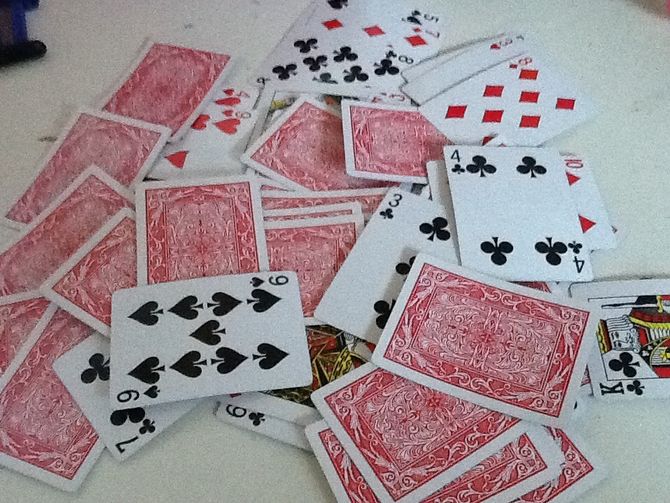
Where is `floor in background`? Image resolution: width=670 pixels, height=503 pixels. floor in background is located at coordinates (659, 7).